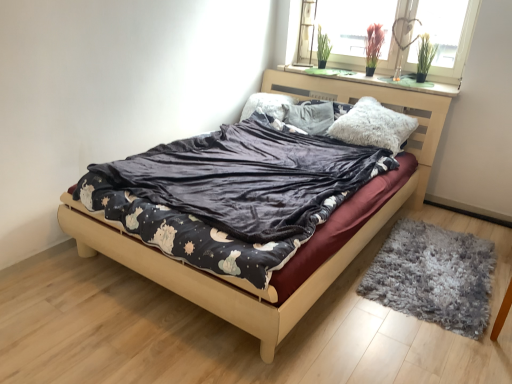
Question: Could velvet dark gray blanket at center be considered to be inside fluffy white pillow at upper center, which ranks as the 1th pillow in back-to-front order?

Choices:
 (A) yes
 (B) no

Answer: (B)

Question: Could you tell me if fluffy white pillow at upper center, the 2th pillow from the front, is facing velvet dark gray blanket at center?

Choices:
 (A) yes
 (B) no

Answer: (A)

Question: Does fluffy white pillow at upper center, which is the 1th pillow from left to right, have a larger size compared to velvet dark gray blanket at center?

Choices:
 (A) yes
 (B) no

Answer: (B)

Question: Considering the relative sizes of fluffy white pillow at upper center, which ranks as the 1th pillow in back-to-front order, and velvet dark gray blanket at center in the image provided, is fluffy white pillow at upper center, which ranks as the 1th pillow in back-to-front order, taller than velvet dark gray blanket at center?

Choices:
 (A) no
 (B) yes

Answer: (B)

Question: Is fluffy white pillow at upper center, the 2th pillow from the front, next to velvet dark gray blanket at center?

Choices:
 (A) yes
 (B) no

Answer: (B)

Question: Choose the correct answer: Is fluffy white pillow at upper center, which is the 1th pillow from left to right, inside glass window at upper right or outside it?

Choices:
 (A) outside
 (B) inside

Answer: (A)

Question: From a real-world perspective, is fluffy white pillow at upper center, the 2th pillow from the right, above or below glass window at upper right?

Choices:
 (A) below
 (B) above

Answer: (A)

Question: Is point (269, 114) closer or farther from the camera than point (434, 9)?

Choices:
 (A) closer
 (B) farther

Answer: (B)

Question: Considering the positions of fluffy white pillow at upper center, the 2th pillow from the front, and glass window at upper right in the image, is fluffy white pillow at upper center, the 2th pillow from the front, bigger or smaller than glass window at upper right?

Choices:
 (A) small
 (B) big

Answer: (A)

Question: From the image's perspective, is glass window at upper right positioned above or below velvet dark blue bed at center?

Choices:
 (A) above
 (B) below

Answer: (A)

Question: Does point (353, 64) appear closer or farther from the camera than point (165, 271)?

Choices:
 (A) farther
 (B) closer

Answer: (A)

Question: In terms of width, does glass window at upper right look wider or thinner when compared to velvet dark blue bed at center?

Choices:
 (A) thin
 (B) wide

Answer: (A)

Question: Considering their positions, is glass window at upper right located in front of or behind velvet dark blue bed at center?

Choices:
 (A) front
 (B) behind

Answer: (B)

Question: From the image's perspective, relative to glass window at upper right, is gray shaggy rug at lower right above or below?

Choices:
 (A) below
 (B) above

Answer: (A)

Question: Is gray shaggy rug at lower right bigger or smaller than glass window at upper right?

Choices:
 (A) big
 (B) small

Answer: (B)